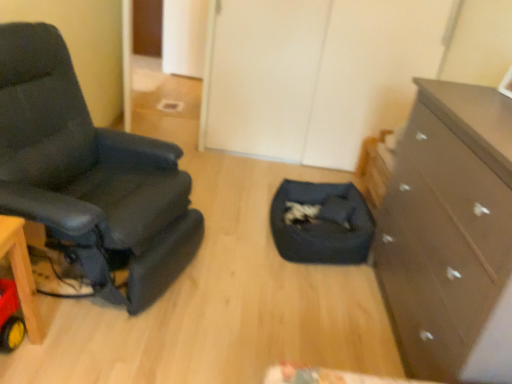
Question: From the image's perspective, would you say dark brown wooden chest of drawers at right is shown under dark blue fabric pet bed at center?

Choices:
 (A) no
 (B) yes

Answer: (B)

Question: From a real-world perspective, is dark brown wooden chest of drawers at right below dark blue fabric pet bed at center?

Choices:
 (A) yes
 (B) no

Answer: (B)

Question: Considering the relative sizes of dark brown wooden chest of drawers at right and dark blue fabric pet bed at center in the image provided, is dark brown wooden chest of drawers at right bigger than dark blue fabric pet bed at center?

Choices:
 (A) yes
 (B) no

Answer: (A)

Question: Can you confirm if dark brown wooden chest of drawers at right is positioned to the right of dark blue fabric pet bed at center?

Choices:
 (A) yes
 (B) no

Answer: (A)

Question: From a real-world perspective, is dark brown wooden chest of drawers at right over dark blue fabric pet bed at center?

Choices:
 (A) yes
 (B) no

Answer: (A)

Question: Based on their sizes in the image, would you say dark blue fabric pet bed at center is bigger or smaller than dark brown wooden chest of drawers at right?

Choices:
 (A) big
 (B) small

Answer: (B)

Question: In the image, is dark blue fabric pet bed at center positioned in front of or behind dark brown wooden chest of drawers at right?

Choices:
 (A) front
 (B) behind

Answer: (B)

Question: Based on their positions, is dark blue fabric pet bed at center located to the left or right of dark brown wooden chest of drawers at right?

Choices:
 (A) right
 (B) left

Answer: (B)

Question: Choose the correct answer: Is dark blue fabric pet bed at center inside dark brown wooden chest of drawers at right or outside it?

Choices:
 (A) inside
 (B) outside

Answer: (B)

Question: Is dark brown wooden chest of drawers at right taller or shorter than dark blue fabric pet bed at center?

Choices:
 (A) short
 (B) tall

Answer: (B)

Question: From a real-world perspective, is dark brown wooden chest of drawers at right above or below dark blue fabric pet bed at center?

Choices:
 (A) above
 (B) below

Answer: (A)

Question: Choose the correct answer: Is dark brown wooden chest of drawers at right inside dark blue fabric pet bed at center or outside it?

Choices:
 (A) inside
 (B) outside

Answer: (B)

Question: Looking at their shapes, would you say dark brown wooden chest of drawers at right is wider or thinner than dark blue fabric pet bed at center?

Choices:
 (A) thin
 (B) wide

Answer: (A)

Question: Is point [x=492, y=148] closer or farther from the camera than point [x=24, y=140]?

Choices:
 (A) closer
 (B) farther

Answer: (A)

Question: Is dark brown wooden chest of drawers at right situated inside black leather chair at left or outside?

Choices:
 (A) outside
 (B) inside

Answer: (A)